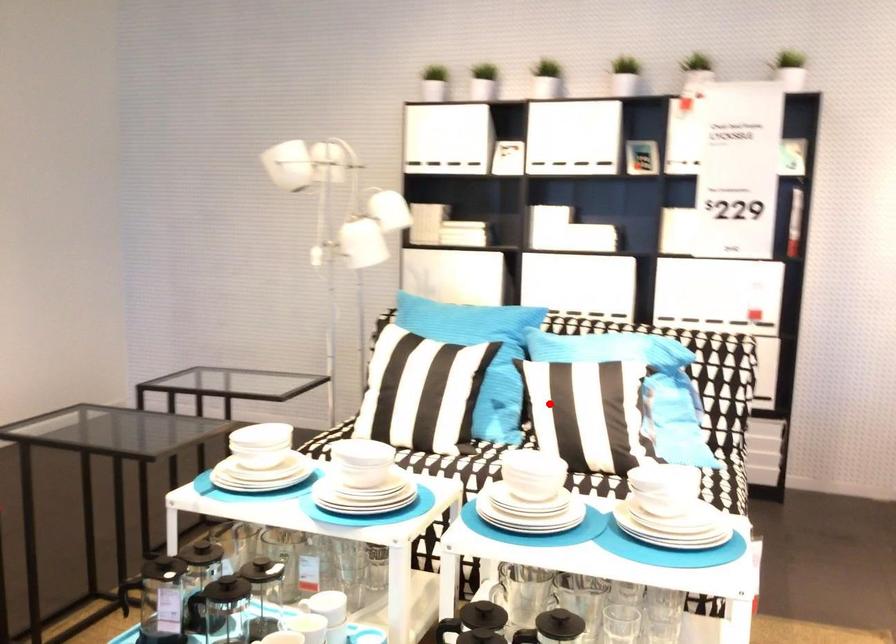
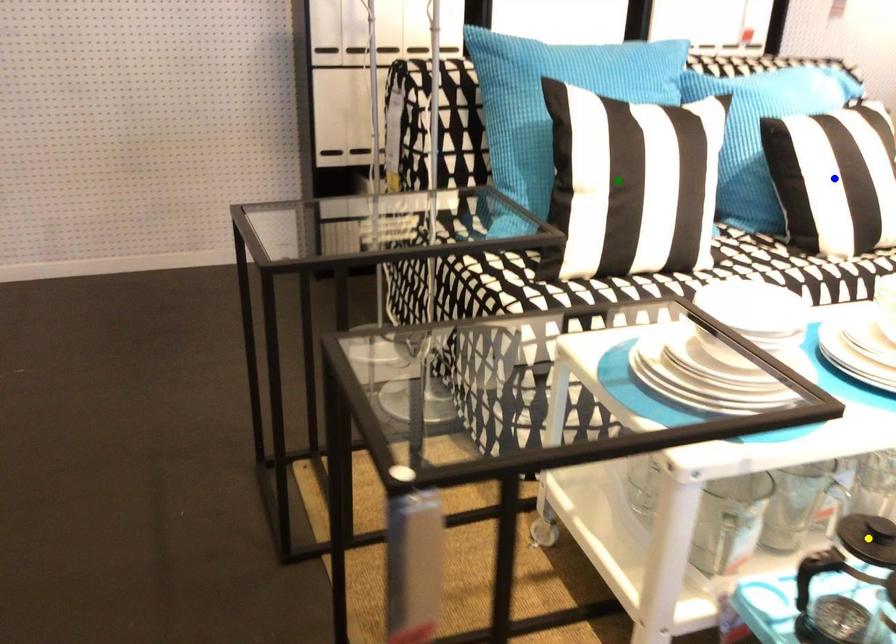
Question: I am providing you with two images of the same scene from different viewpoints. A red point is marked on the first image. You are given multiple points on the second image. Which point in image 2 is actually the same real-world point as the red point in image 1?

Choices:
 (A) yellow point
 (B) blue point
 (C) green point

Answer: (B)